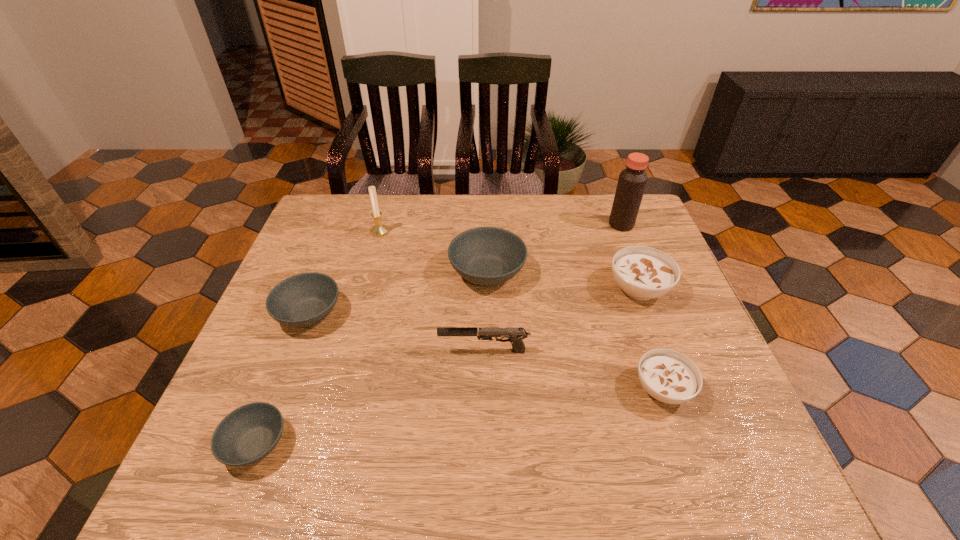
This screenshot has width=960, height=540. I want to click on the tallest object, so click(632, 181).

At what (x,y) coordinates should I click in order to perform the action: click on brown vinegar. Please return your answer as a coordinate pair (x, y). Image resolution: width=960 pixels, height=540 pixels. Looking at the image, I should click on (632, 181).

I want to click on the third object from left to right, so click(379, 229).

At what (x,y) coordinates should I click in order to perform the action: click on the second tallest object. Please return your answer as a coordinate pair (x, y). Looking at the image, I should click on (379, 229).

At what (x,y) coordinates should I click in order to perform the action: click on the rightmost gray soup bowl. Please return your answer as a coordinate pair (x, y). Looking at the image, I should click on (486, 256).

Image resolution: width=960 pixels, height=540 pixels. What are the coordinates of `the third soup bowl from left to right` in the screenshot? It's located at (486, 256).

Locate an element on the screen. the bigger white soup bowl is located at coordinates (643, 273).

Find the location of a particular element. The height and width of the screenshot is (540, 960). gun is located at coordinates (515, 335).

At what (x,y) coordinates should I click in order to perform the action: click on the third nearest object. Please return your answer as a coordinate pair (x, y). This screenshot has height=540, width=960. Looking at the image, I should click on (515, 335).

Locate an element on the screen. The height and width of the screenshot is (540, 960). the second smallest gray soup bowl is located at coordinates (303, 300).